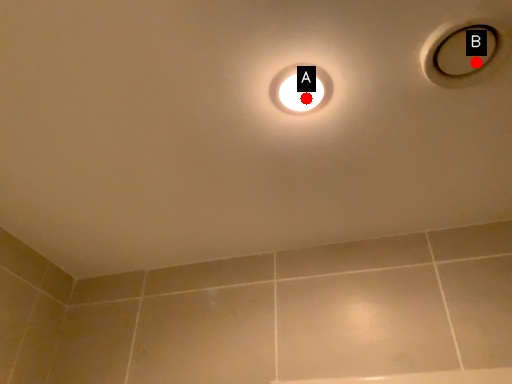
Question: Two points are circled on the image, labeled by A and B beside each circle. Which point is closer to the camera?

Choices:
 (A) A is closer
 (B) B is closer

Answer: (B)